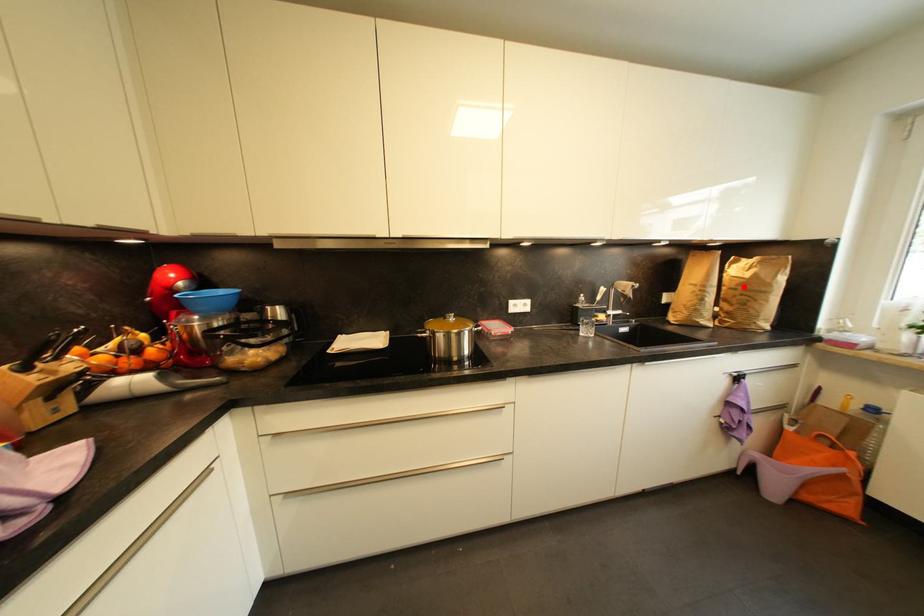
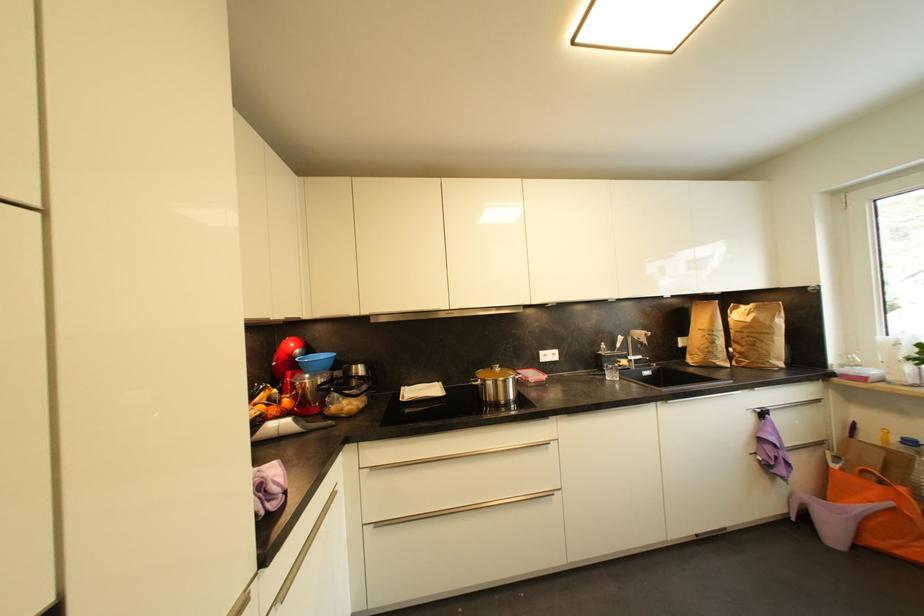
Where in the second image is the point corresponding to the highlighted location from the first image?

(748, 330)